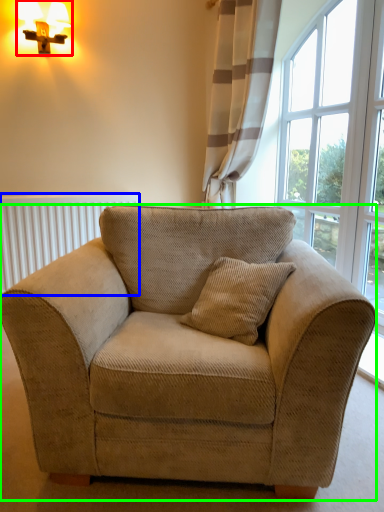
Question: Which object is positioned farthest from table lamp (highlighted by a red box)? Select from radiator (highlighted by a blue box) and studio couch (highlighted by a green box).

Choices:
 (A) radiator
 (B) studio couch

Answer: (B)